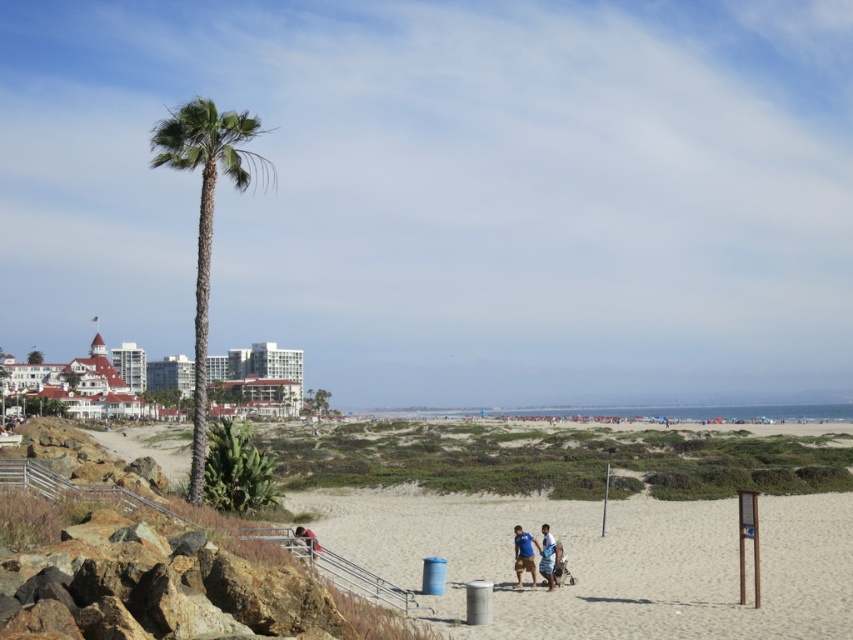
You are a photographer trying to capture a wide shot of the beach scene. You notice the green leafy palm tree at left and the blue denim shorts at lower center in your frame. Based on their sizes in the image, which object would likely be closer to you?

The green leafy palm tree at left is wider than the blue denim shorts at lower center, so it would likely be closer to you since closer objects appear larger in the frame.